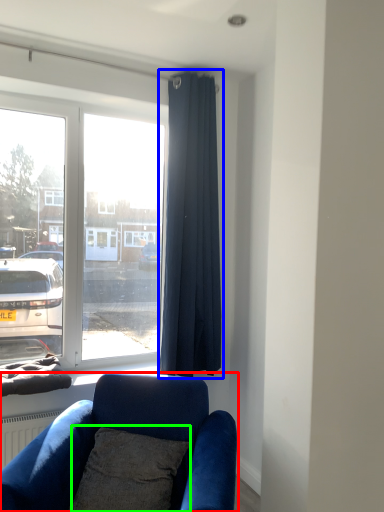
Question: Considering the real-world distances, which object is farthest from studio couch (highlighted by a red box)? curtain (highlighted by a blue box) or pillow (highlighted by a green box)?

Choices:
 (A) curtain
 (B) pillow

Answer: (A)